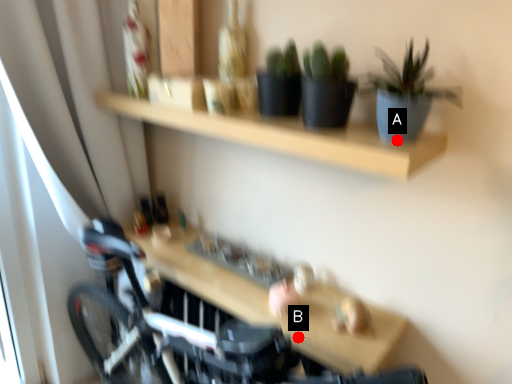
Question: Two points are circled on the image, labeled by A and B beside each circle. Which point is closer to the camera?

Choices:
 (A) A is closer
 (B) B is closer

Answer: (A)